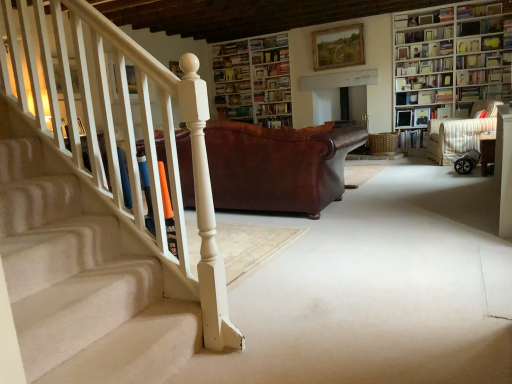
Question: Is hardcover book at upper right, positioned as the 4th book in top-to-bottom order, taller or shorter than wooden bookcase at upper right, the 2th bookcase viewed from the left?

Choices:
 (A) tall
 (B) short

Answer: (B)

Question: From the image's perspective, is hardcover book at upper right, acting as the 8th book starting from the bottom, positioned above or below wooden bookcase at upper right, which is the 1th bookcase from front to back?

Choices:
 (A) below
 (B) above

Answer: (B)

Question: Estimate the real-world distances between objects in this image. Which object is closer to the white wooden bookcase at upper center, which is the 1th bookcase in back-to-front order?

Choices:
 (A) hardcover book at upper right, the 10th book when ordered from bottom to top
 (B) hardcover book at upper right, acting as the eleventh book starting from the top
 (C) hardcover book at upper right, placed as the third book when sorted from top to bottom
 (D) hardcover book at upper right, the 3th book ordered from the bottom
 (E) striped fabric armchair at right

Answer: (A)

Question: Estimate the real-world distances between objects in this image. Which object is farther from the hardcover book at upper right, the 6th book in the top-to-bottom sequence?

Choices:
 (A) brown leather couch at center
 (B) hardcover book at upper right, positioned as the 4th book in top-to-bottom order
 (C) wooden picture frame at upper center
 (D) wooden bookshelf at upper right, the second shelf in the front-to-back sequence
 (E) wooden bookshelf at upper right, the 1th shelf when ordered from right to left

Answer: (A)